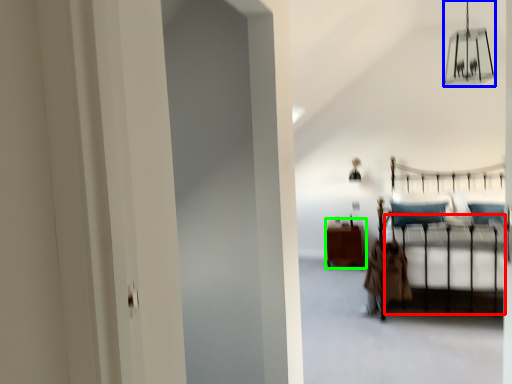
Question: Which object is positioned closest to bed frame (highlighted by a red box)? Select from lamp (highlighted by a blue box) and furniture (highlighted by a green box).

Choices:
 (A) lamp
 (B) furniture

Answer: (B)